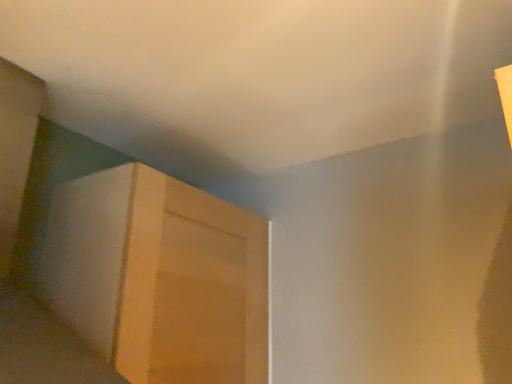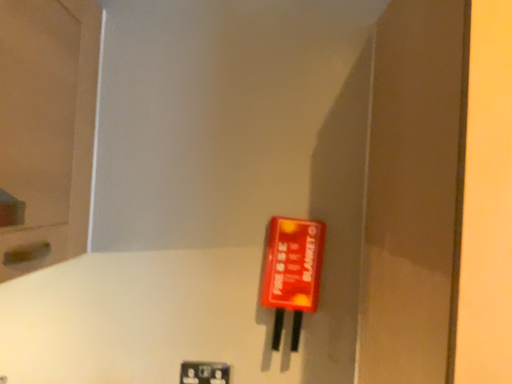
Question: Which way did the camera rotate in the video?

Choices:
 (A) rotated right
 (B) rotated left

Answer: (A)